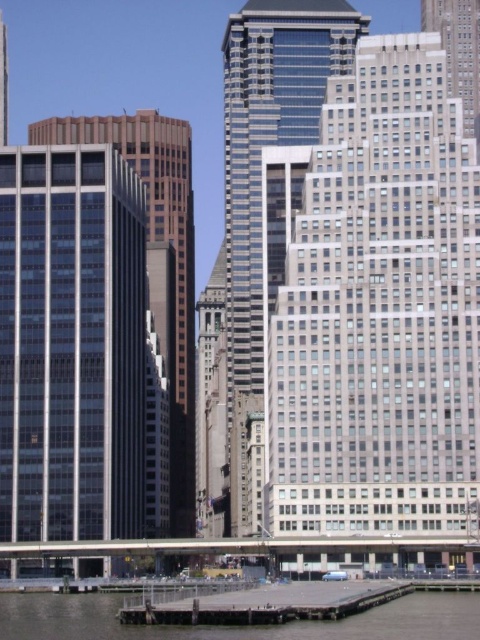
Question: Which point is farther to the camera?

Choices:
 (A) glassy blue skyscraper at center
 (B) gray concrete dock at lower center
 (C) smooth brown building at left

Answer: (C)

Question: Is glassy steel skyscraper at center above glassy blue skyscraper at center?

Choices:
 (A) yes
 (B) no

Answer: (B)

Question: Does glassy steel skyscraper at center have a lesser width compared to gray concrete dock at lower center?

Choices:
 (A) no
 (B) yes

Answer: (B)

Question: Does gray concrete dock at lower center appear on the right side of smooth brown building at left?

Choices:
 (A) yes
 (B) no

Answer: (A)

Question: Which of the following is the closest to the observer?

Choices:
 (A) smooth brown building at left
 (B) wooden dock at lower center
 (C) gray concrete dock at lower center

Answer: (C)

Question: Which of these objects is positioned closest to the wooden dock at lower center?

Choices:
 (A) glassy steel skyscraper at center
 (B) smooth brown building at left

Answer: (A)